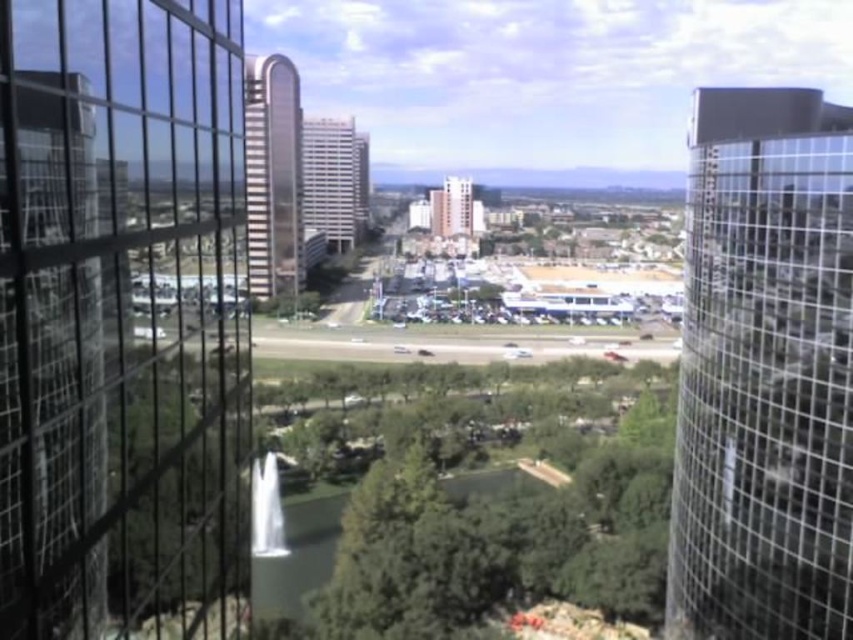
Can you confirm if green leafy tree at center is wider than clear glass tower at right?

Yes.

Does green leafy tree at center have a lesser height compared to clear glass tower at right?

Yes.

Is point (422, 413) closer to camera compared to point (850, 278)?

No, (422, 413) is behind (850, 278).

The image size is (853, 640). In order to click on green leafy tree at center in this screenshot , I will do `click(469, 499)`.

Is green leafy tree at center to the right of sleek silver tower at center from the viewer's perspective?

Indeed, green leafy tree at center is positioned on the right side of sleek silver tower at center.

Between point (354, 381) and point (253, 173), which one is positioned in front?

Point (354, 381) is more forward.

Measure the distance between green leafy tree at center and camera.

green leafy tree at center is 42.37 meters away from camera.

In order to click on green leafy tree at center in this screenshot , I will do `click(469, 499)`.

Is transparent glass window at left shorter than clear glass tower at right?

Yes.

Between transparent glass window at left and clear glass tower at right, which one has less height?

With less height is transparent glass window at left.

Who is more distant from viewer, (82, 83) or (755, 545)?

The point (755, 545) is more distant.

In order to click on transparent glass window at left in this screenshot , I will do `click(122, 321)`.